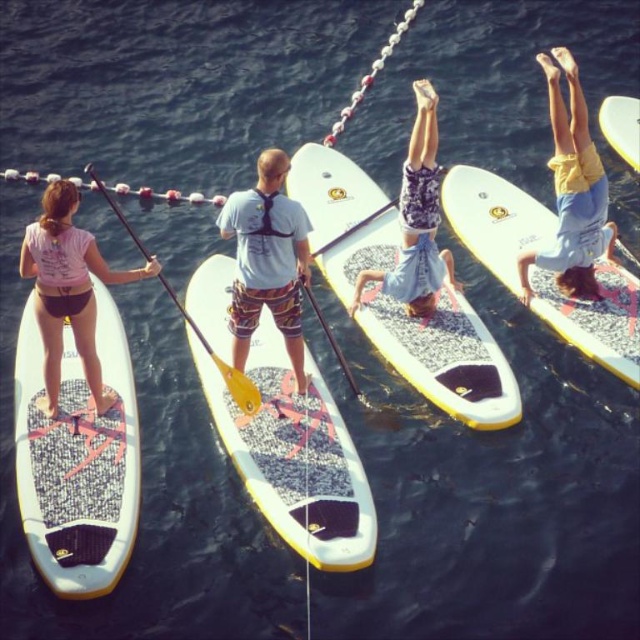
From the picture: You are observing a group of people paddleboarding from above. You notice two points marked on the image at coordinates point (433, 120) and point (637, 116). Based on their positions, which point is closer to your viewpoint?

Point (433, 120) is closer to the camera than point (637, 116).

You are a photographer standing on a tall boat nearby. You want to take a photo of both the white textured surfboard at center and the pink matte shirt at upper left in the same frame. Considering the distance between them, will you be able to capture both in one shot if your camera has a 50mm lens?

The white textured surfboard at center and the pink matte shirt at upper left are 16.62 feet apart. With a 50mm lens, which has a moderate field of view, it might be challenging to capture both subjects in one frame if they are 16.62 feet apart, as this distance could exceed the lens coverage at typical shooting distances. You might need to adjust your position or use a wider lens.